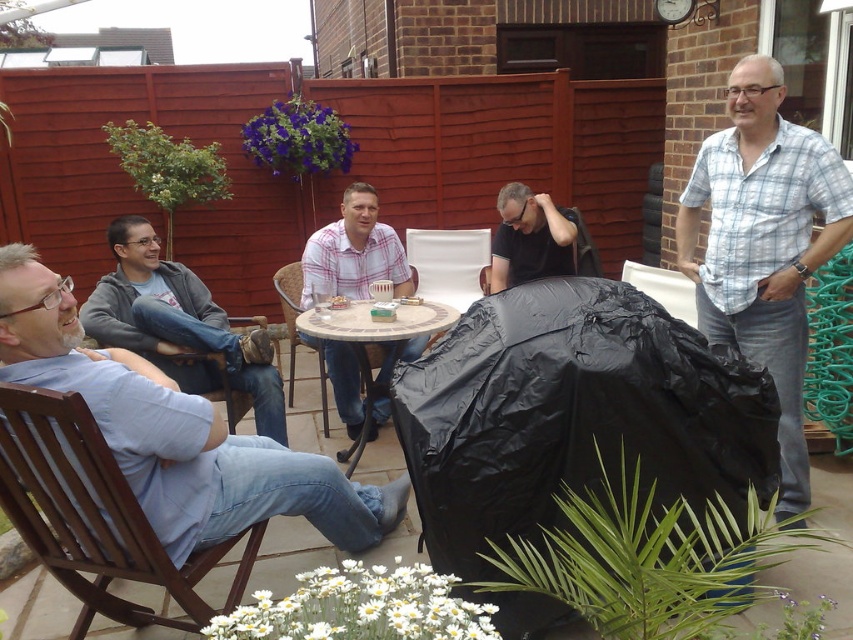
Question: Which of these objects is positioned farthest from the wooden chair at lower left?

Choices:
 (A) matte black bag at center
 (B) plaid shirt at center

Answer: (A)

Question: Is white fabric chair at center wider than black plastic chair at center?

Choices:
 (A) no
 (B) yes

Answer: (B)

Question: Can you confirm if light blue denim jeans at lower left is positioned below light blue plaid shirt at right?

Choices:
 (A) no
 (B) yes

Answer: (B)

Question: Can you confirm if matte black bag at center is positioned to the left of wooden chair at center?

Choices:
 (A) yes
 (B) no

Answer: (B)

Question: Based on their relative distances, which object is farther from the light blue plaid shirt at right?

Choices:
 (A) black plastic chair at center
 (B) mosaic tile table at center
 (C) gray fleece jacket at left
 (D) matte black bag at center

Answer: (C)

Question: Estimate the real-world distances between objects in this image. Which object is closer to the white fabric chair at center?

Choices:
 (A) light blue plaid shirt at right
 (B) mosaic tile table at center
 (C) black plastic chair at center

Answer: (B)